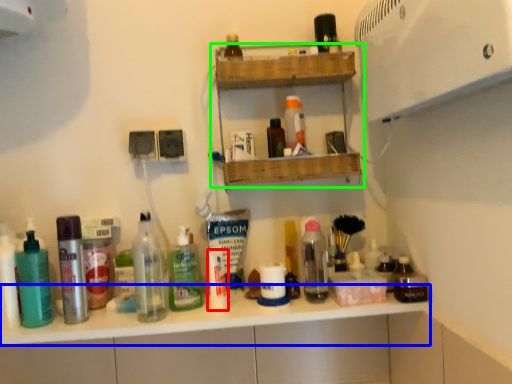
Question: Which object is the farthest from toiletry (highlighted by a red box)? Choose among these: counter top (highlighted by a blue box) or shelf (highlighted by a green box).

Choices:
 (A) counter top
 (B) shelf

Answer: (B)